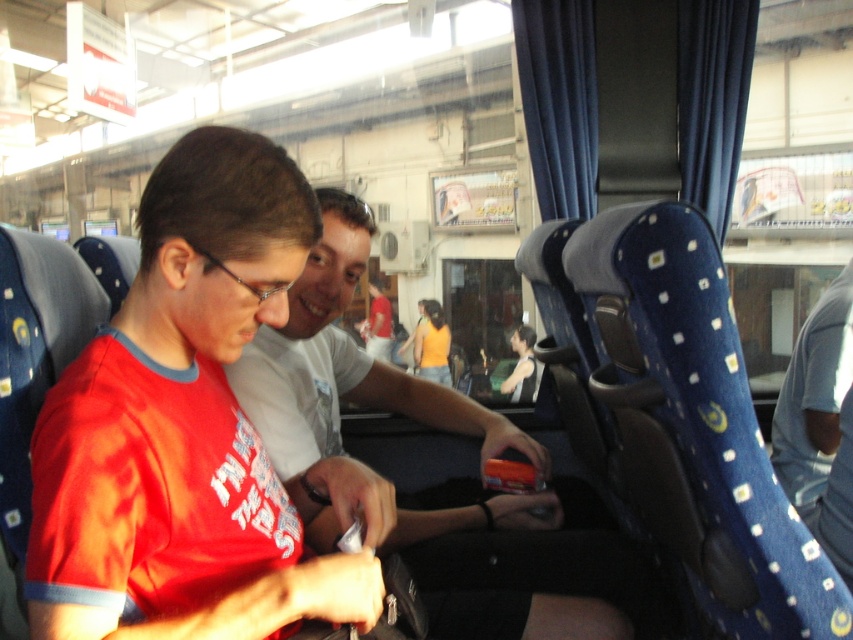
You are standing at the point labeled as point [822,374] on the bus floor. You want to take a photo of the two people seated near the front using your camera. Can you capture both individuals in a single frame without moving the camera? Explain your reasoning based on the distance between the point and the camera.

The distance between point [822,374] and the camera is 1.74 meters. Since the camera is positioned at this distance from the point, you can likely capture both individuals in a single frame if their positions are within the camera lens field of view at that distance. However, the exact framing depends on the camera lens type and zoom level, but the 1.74 meters distance allows for a wide enough angle to potentially include both people seated nearby.

You are a passenger on the bus and want to place your small backpack on the seat at point [345,364]. However, there is an object there. What is the object?

The object at point [345,364] is the matte red shirt at center.

You are a passenger on the bus and want to reach the overhead compartment without disturbing the person with matte black hair at center. Is the blue denim jeans at lower right blocking your path?

The blue denim jeans at lower right is in front of matte black hair at center, so reaching the overhead compartment might require moving around the blue denim jeans at lower right to avoid disturbing the person with matte black hair at center.